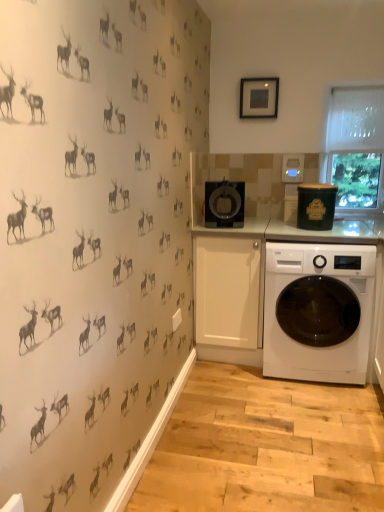
Question: Is point (302, 199) closer or farther from the camera than point (254, 101)?

Choices:
 (A) closer
 (B) farther

Answer: (A)

Question: In terms of height, does green matte canister at upper right, which is the second appliance from left to right, look taller or shorter compared to matte black picture frame at upper center?

Choices:
 (A) tall
 (B) short

Answer: (A)

Question: Estimate the real-world distances between objects in this image. Which object is closer to the green matte canister at upper right, which appears as the first appliance when viewed from the right?

Choices:
 (A) black glossy coffee maker at center, the 1th appliance positioned from the left
 (B) matte black picture frame at upper center
 (C) white mesh screen at upper right
 (D) white glossy washing machine at lower right

Answer: (C)

Question: Which object is positioned farthest from the white mesh screen at upper right?

Choices:
 (A) green matte canister at upper right, which is the second appliance from left to right
 (B) black glossy coffee maker at center, which ranks as the 2th appliance in right-to-left order
 (C) matte black picture frame at upper center
 (D) white glossy washing machine at lower right

Answer: (D)